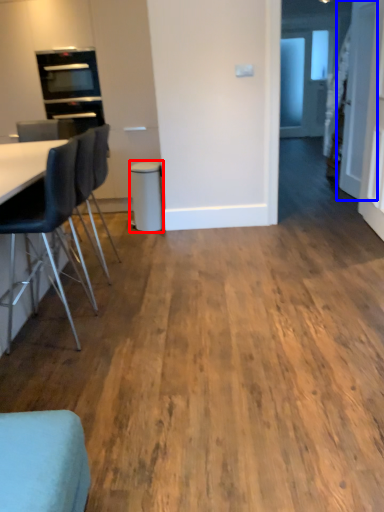
Question: Which object is further to the camera taking this photo, bar stool (highlighted by a red box) or door (highlighted by a blue box)?

Choices:
 (A) bar stool
 (B) door

Answer: (A)